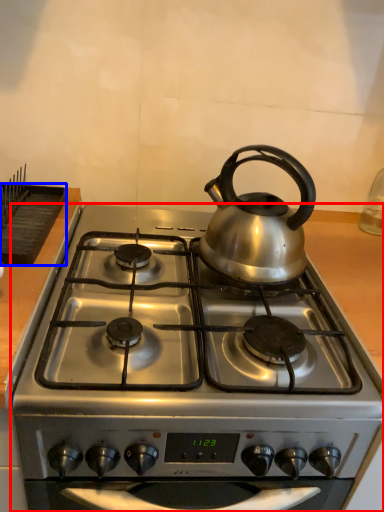
Question: Which of the following is the closest to the observer, gas stove (highlighted by a red box) or kitchen appliance (highlighted by a blue box)?

Choices:
 (A) gas stove
 (B) kitchen appliance

Answer: (A)